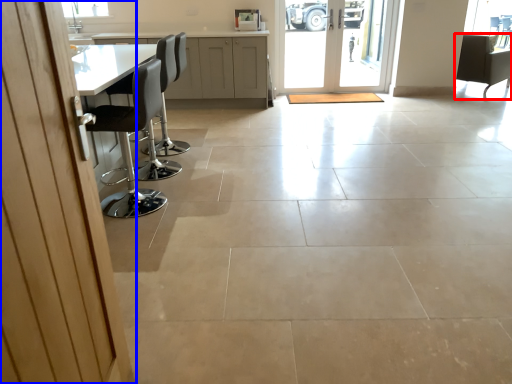
Question: Among these objects, which one is farthest to the camera, chair (highlighted by a red box) or door (highlighted by a blue box)?

Choices:
 (A) chair
 (B) door

Answer: (A)